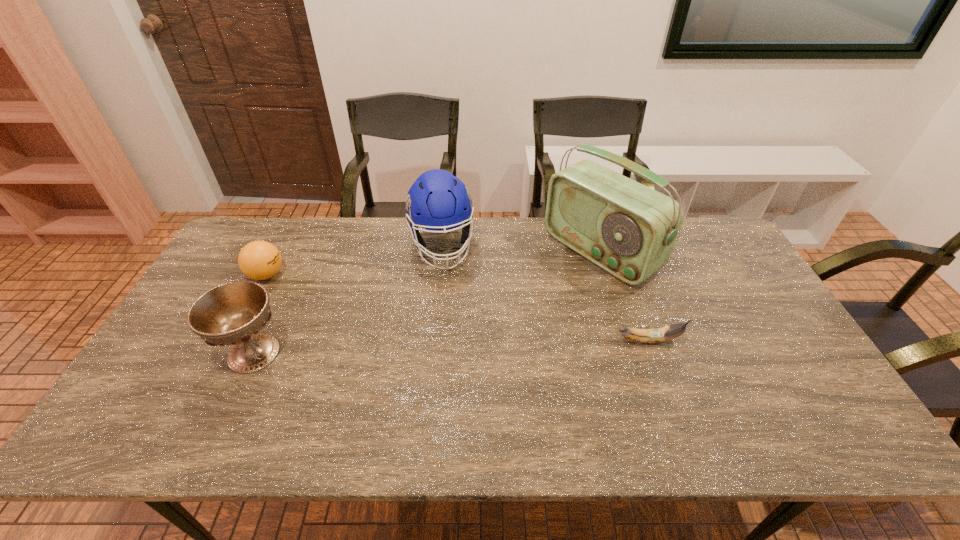
The height and width of the screenshot is (540, 960). I want to click on chalice that is at the left edge, so click(234, 313).

Find the location of a particular element. ping-pong ball at the left edge is located at coordinates (259, 260).

In order to click on object at the near left corner in this screenshot , I will do `click(234, 313)`.

The image size is (960, 540). What are the coordinates of `vacant space at the far edge` in the screenshot? It's located at pos(336,261).

The width and height of the screenshot is (960, 540). I want to click on vacant space at the near edge, so click(647, 387).

This screenshot has width=960, height=540. I want to click on vacant region at the left edge, so click(x=226, y=271).

Locate an element on the screen. The height and width of the screenshot is (540, 960). free point at the right edge is located at coordinates (782, 335).

At what (x,y) coordinates should I click in order to perform the action: click on free space at the near right corner. Please return your answer as a coordinate pair (x, y). Image resolution: width=960 pixels, height=540 pixels. Looking at the image, I should click on (776, 380).

At what (x,y) coordinates should I click in order to perform the action: click on free space that is in between the ping-pong ball and the third object from right to left. Please return your answer as a coordinate pair (x, y). Looking at the image, I should click on (354, 260).

Locate an element on the screen. vacant area that lies between the football helmet and the third shortest object is located at coordinates (348, 299).